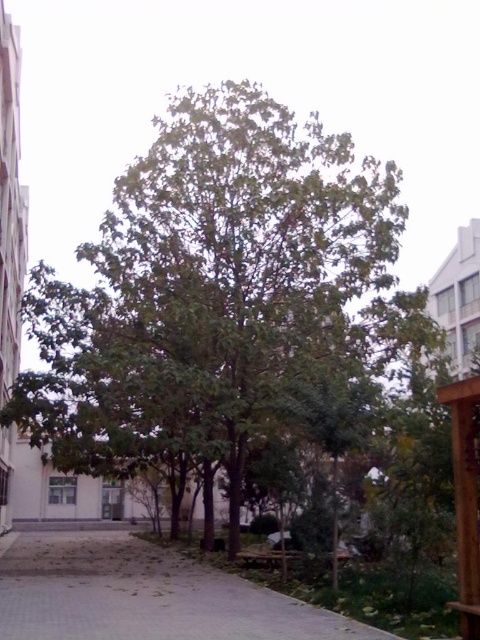
Which of these two, green leafy tree at center or gray concrete pavement at lower center, stands taller?

Standing taller between the two is green leafy tree at center.

Is point (254, 292) more distant than point (322, 612)?

Yes, it is.

Where is `green leafy tree at center`? The height and width of the screenshot is (640, 480). green leafy tree at center is located at coordinates (222, 298).